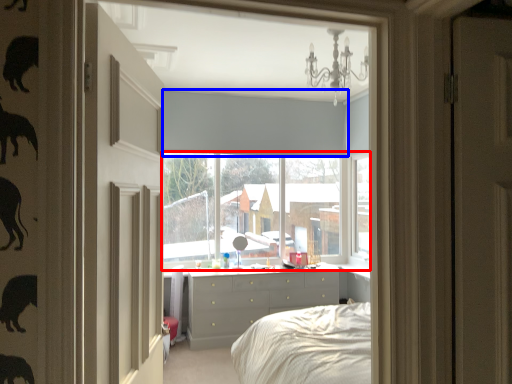
Question: Which point is further to the camera, window (highlighted by a red box) or blind (highlighted by a blue box)?

Choices:
 (A) window
 (B) blind

Answer: (A)